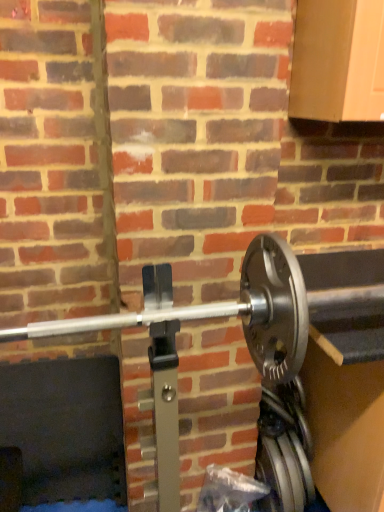
The width and height of the screenshot is (384, 512). What do you see at coordinates (284, 449) in the screenshot?
I see `silver metallic weight at center-right` at bounding box center [284, 449].

Measure the distance between point (313, 493) and camera.

Point (313, 493) is 4.58 feet away from camera.

Locate an element on the screen. This screenshot has width=384, height=512. silver metallic weight at center-right is located at coordinates (284, 449).

You are a GUI agent. You are given a task and a screenshot of the screen. Output one action in this format:
    pyautogui.click(x=<x>, y=<y>)
    Task: Click on the silver metallic weight at center-right
    
    Given the screenshot: What is the action you would take?
    pyautogui.click(x=284, y=449)